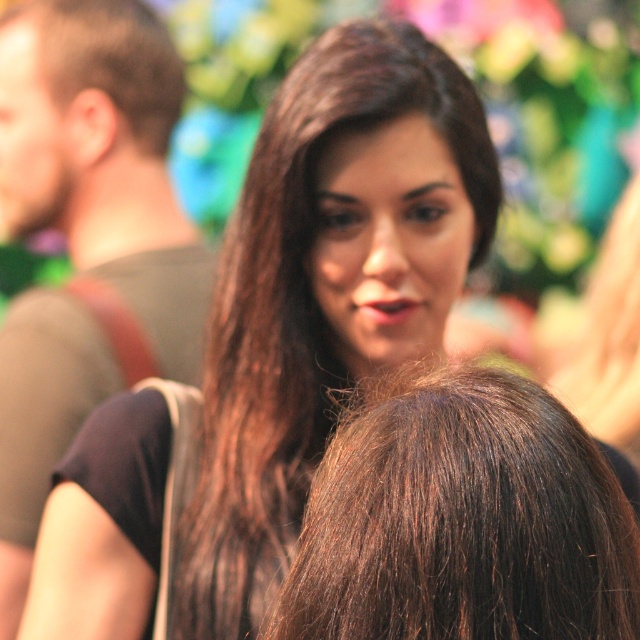
Question: From the image, what is the correct spatial relationship of brown shiny hair at center in relation to brown shiny hair at upper left?

Choices:
 (A) left
 (B) right

Answer: (B)

Question: Which object is closer to the camera taking this photo?

Choices:
 (A) brown hair at upper left
 (B) brown shiny hair at upper left

Answer: (A)

Question: Which point is closer to the camera?

Choices:
 (A) (51, 26)
 (B) (433, 483)

Answer: (B)

Question: Can you confirm if brown shiny hair at center is positioned to the right of brown shiny hair at upper left?

Choices:
 (A) yes
 (B) no

Answer: (A)

Question: Based on their relative distances, which object is farther from the brown shiny hair at upper left?

Choices:
 (A) brown hair at upper left
 (B) brown shiny hair at center

Answer: (B)

Question: Is brown hair at upper left bigger than brown shiny hair at upper left?

Choices:
 (A) no
 (B) yes

Answer: (B)